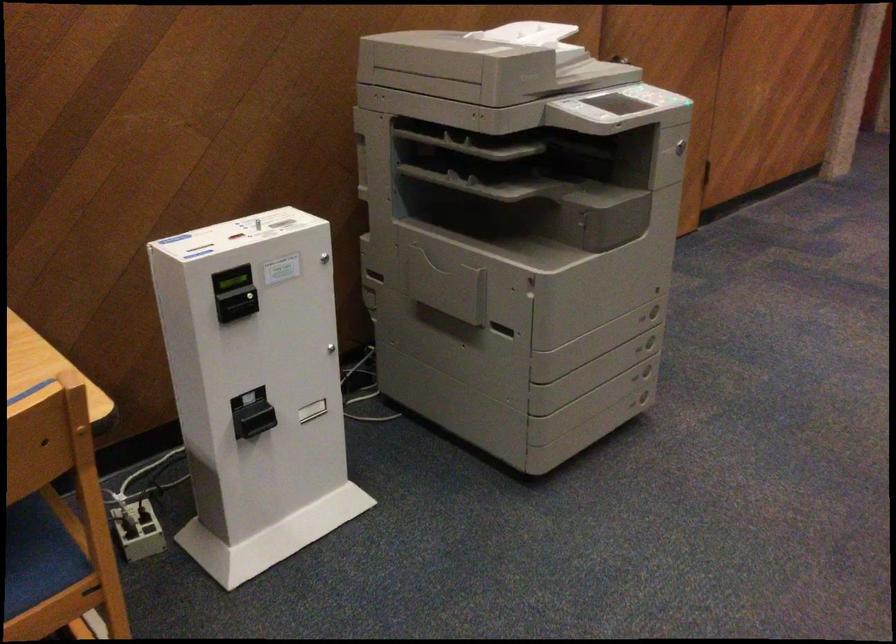
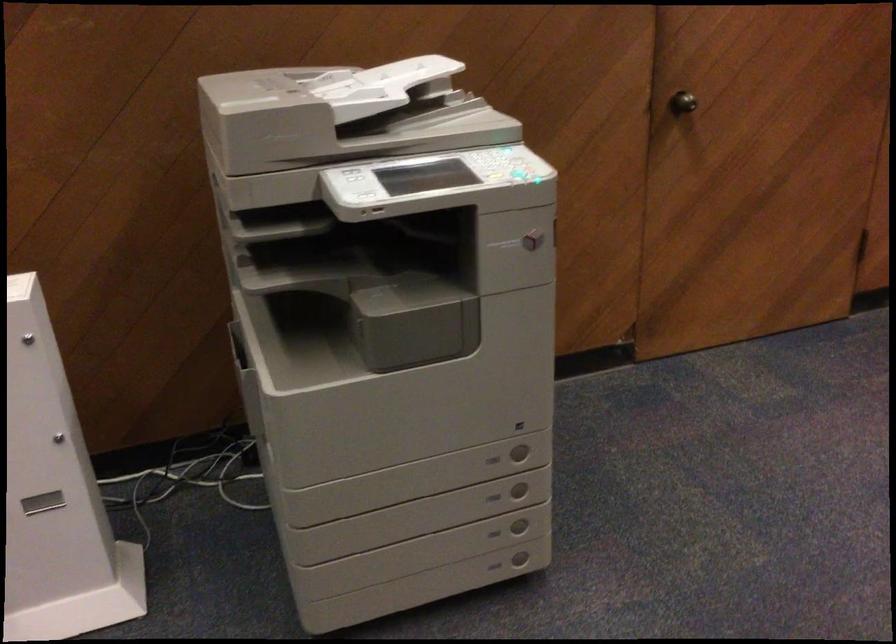
The point at (640, 348) is marked in the first image. Where is the corresponding point in the second image?

(493, 497)